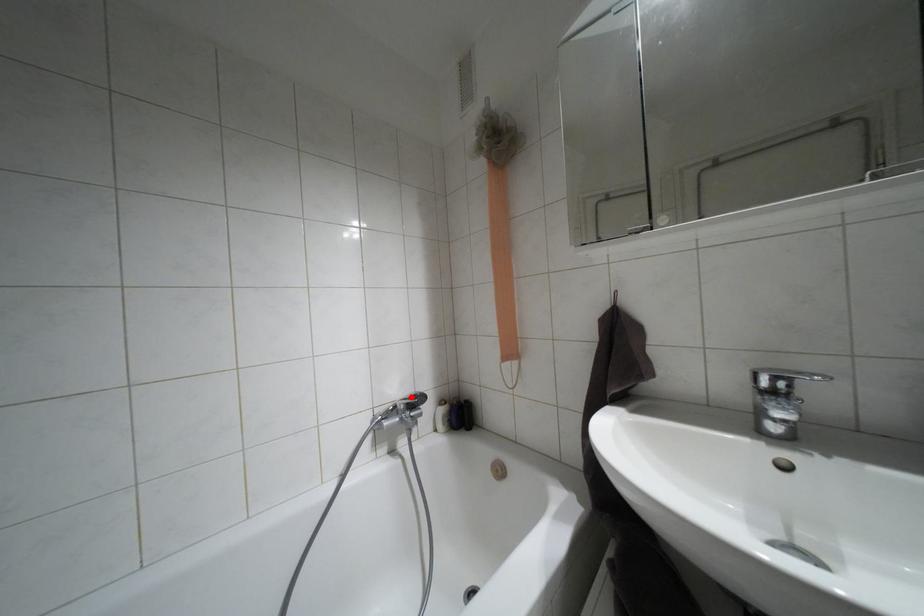
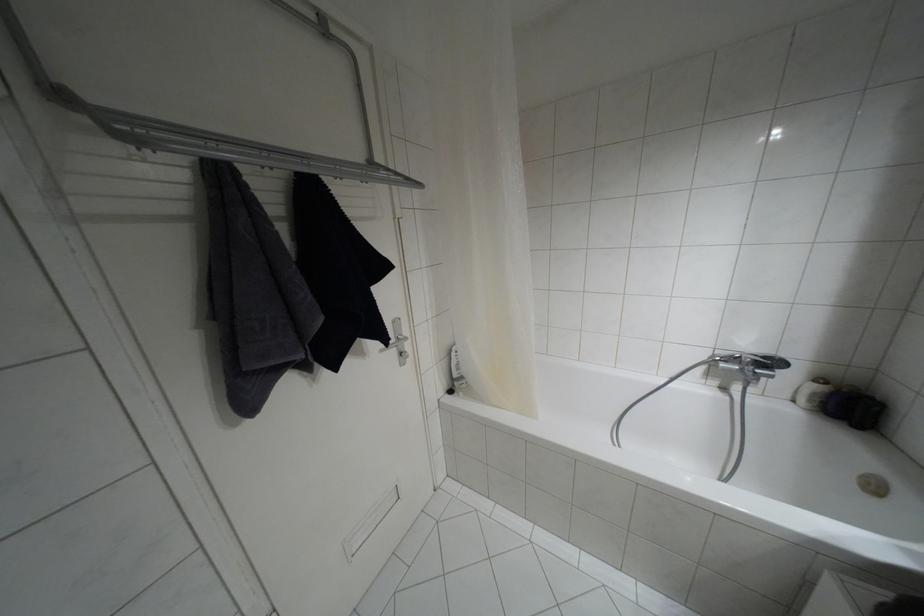
Question: I am providing you with two images of the same scene from different viewpoints. A red point is marked on the first image. At the location where the point appears in image 1, is it still visible in image 2?

Choices:
 (A) Yes
 (B) No

Answer: (A)